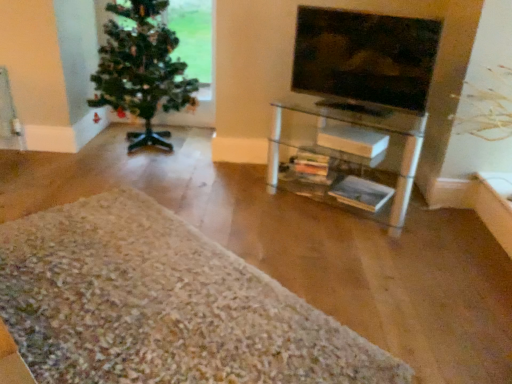
Where is `vacant location below matte glass tv at upper right (from a real-world perspective)`? The image size is (512, 384). vacant location below matte glass tv at upper right (from a real-world perspective) is located at coordinates (361, 106).